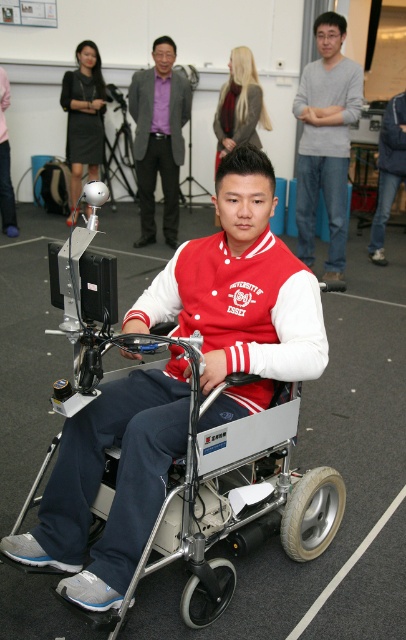
Question: Can you confirm if gray cotton shirt at upper center is smaller than blonde hair at upper center?

Choices:
 (A) yes
 (B) no

Answer: (B)

Question: Which point is closer to the camera?

Choices:
 (A) matte black dress at upper left
 (B) gray cotton shirt at upper center
 (C) silver metallic mobility scooter at center
 (D) purple shirt at center

Answer: (C)

Question: Among these objects, which one is nearest to the camera?

Choices:
 (A) purple shirt at center
 (B) matte black dress at upper left
 (C) silver metallic mobility scooter at center

Answer: (C)

Question: Considering the real-world distances, which object is farthest from the silver metallic mobility scooter at center?

Choices:
 (A) purple shirt at center
 (B) gray cotton shirt at upper center
 (C) matte black dress at upper left
 (D) blonde hair at upper center

Answer: (C)

Question: Is the position of matte black dress at upper left less distant than that of blonde hair at upper center?

Choices:
 (A) no
 (B) yes

Answer: (A)

Question: Does gray cotton shirt at upper center have a lesser width compared to blonde hair at upper center?

Choices:
 (A) yes
 (B) no

Answer: (A)